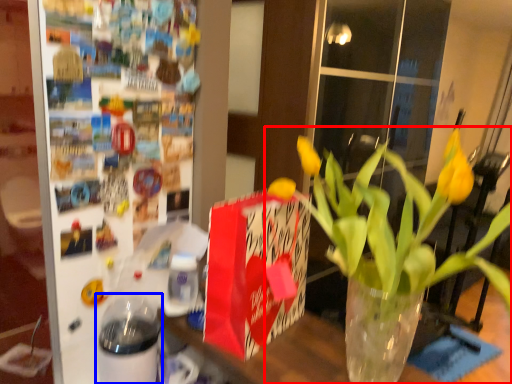
Question: Which object appears closest to the camera in this image, houseplant (highlighted by a red box) or glass jar (highlighted by a blue box)?

Choices:
 (A) houseplant
 (B) glass jar

Answer: (A)